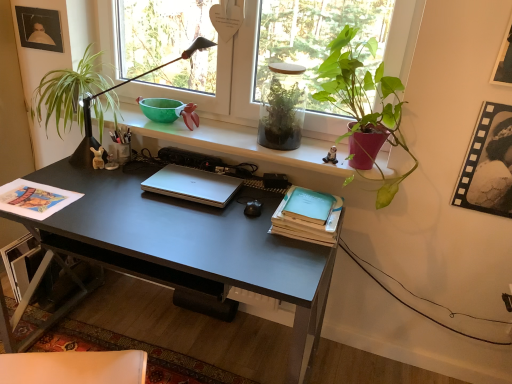
The width and height of the screenshot is (512, 384). What are the coordinates of `vacant location below matte black desk at center (from a real-world perspective)` in the screenshot? It's located at (169, 344).